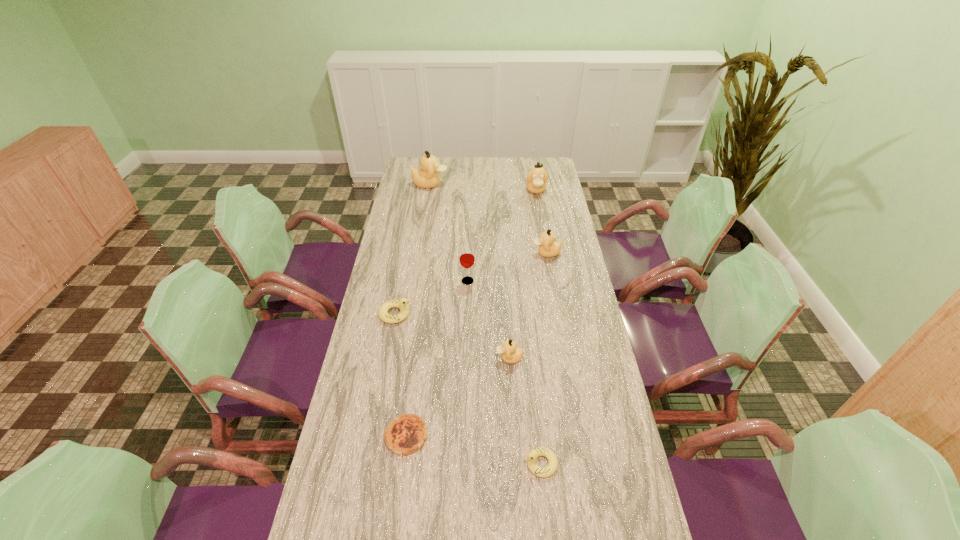
Find the location of `the farther yellow duckling`. the farther yellow duckling is located at coordinates (402, 304).

This screenshot has height=540, width=960. I want to click on the right yellow duckling, so click(532, 457).

You are a GUI agent. You are given a task and a screenshot of the screen. Output one action in this format:
    pyautogui.click(x=<x>, y=<y>)
    Task: Click on the nearest duckling
    The image size is (960, 540).
    Given the screenshot: What is the action you would take?
    pyautogui.click(x=532, y=457)

Locate an element on the screen. Image resolution: width=960 pixels, height=540 pixels. quiche is located at coordinates (406, 434).

Where is `vacant space located 0.100m on the face of the tallest object`? This screenshot has height=540, width=960. vacant space located 0.100m on the face of the tallest object is located at coordinates (468, 184).

Where is `free space located 0.060m on the face of the second tallest duckling`? This screenshot has width=960, height=540. free space located 0.060m on the face of the second tallest duckling is located at coordinates (539, 206).

You are a GUI agent. You are given a task and a screenshot of the screen. Output one action in this format:
    pyautogui.click(x=<x>, y=<y>)
    Task: Click on the free space located 0.380m on the front of the fourth farthest object
    The width and height of the screenshot is (960, 540).
    Given the screenshot: What is the action you would take?
    pyautogui.click(x=465, y=370)

You are a GUI agent. You are given a task and a screenshot of the screen. Output one action in this format:
    pyautogui.click(x=<x>, y=<y>)
    Task: Click on the vacant space situated on the face of the second nearest tan duckling
    The image size is (960, 540).
    Given the screenshot: What is the action you would take?
    pyautogui.click(x=486, y=253)

Find the location of a particular element. The image size is (960, 540). free space located on the face of the second nearest tan duckling is located at coordinates (462, 253).

You are a GUI agent. You are given a task and a screenshot of the screen. Output one action in this format:
    pyautogui.click(x=<x>, y=<y>)
    Task: Click on the vacant area located 0.230m on the face of the second nearest tan duckling
    
    Given the screenshot: What is the action you would take?
    pyautogui.click(x=476, y=253)